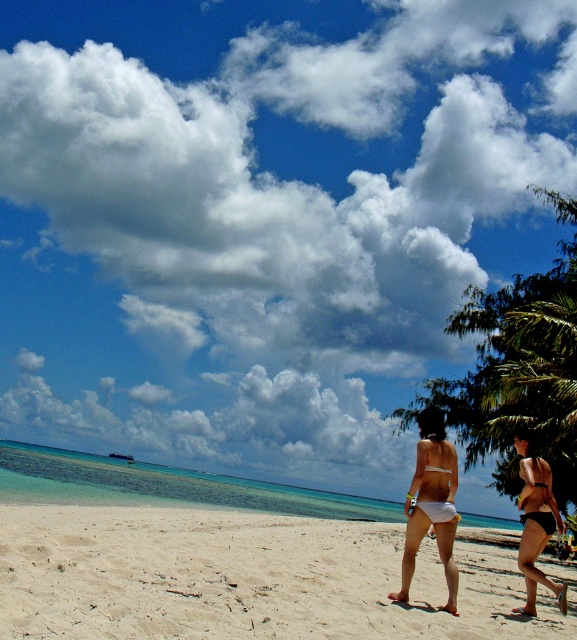
Question: Which of these objects is positioned closest to the white sandy beach at center?

Choices:
 (A) matte black bikini at lower right
 (B) white matte bikini bottom at center

Answer: (A)

Question: Does white sandy beach at center appear over white matte bikini bottom at center?

Choices:
 (A) no
 (B) yes

Answer: (A)

Question: Which of the following is the farthest from the observer?

Choices:
 (A) matte black bikini at lower right
 (B) white matte bikini bottom at center
 (C) white sandy beach at center

Answer: (A)

Question: Which object is the farthest from the white sandy beach at center?

Choices:
 (A) white matte bikini bottom at center
 (B) matte black bikini at lower right

Answer: (A)

Question: From the image, what is the correct spatial relationship of white sandy beach at center in relation to white matte bikini bottom at center?

Choices:
 (A) below
 (B) above

Answer: (A)

Question: Is white sandy beach at center positioned before white matte bikini bottom at center?

Choices:
 (A) yes
 (B) no

Answer: (A)